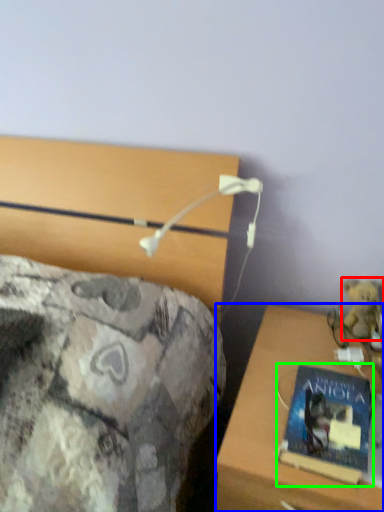
Question: Estimate the real-world distances between objects in this image. Which object is closer to teddy bear (highlighted by a red box), desk (highlighted by a blue box) or book (highlighted by a green box)?

Choices:
 (A) desk
 (B) book

Answer: (A)